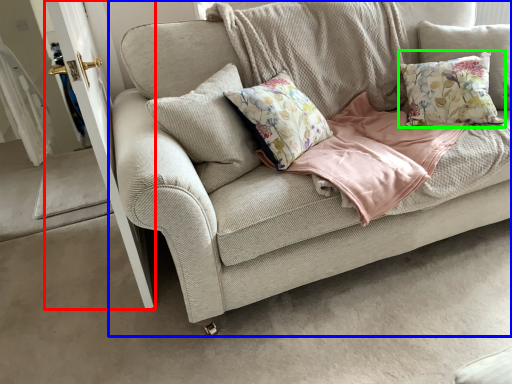
Question: Which object is the farthest from screen door (highlighted by a red box)? Choose among these: studio couch (highlighted by a blue box) or pillow (highlighted by a green box).

Choices:
 (A) studio couch
 (B) pillow

Answer: (B)